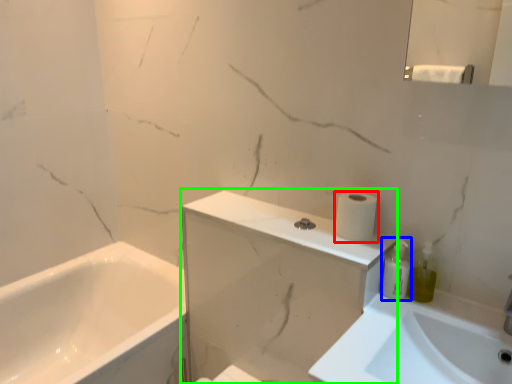
Question: Which is farther away from toilet paper (highlighted by a red box)? toiletry (highlighted by a blue box) or medicine cabinet (highlighted by a green box)?

Choices:
 (A) toiletry
 (B) medicine cabinet

Answer: (B)